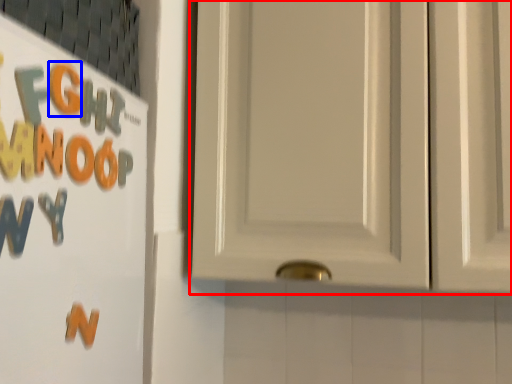
Question: Among these objects, which one is nearest to the camera, door (highlighted by a red box) or letter (highlighted by a blue box)?

Choices:
 (A) door
 (B) letter

Answer: (B)